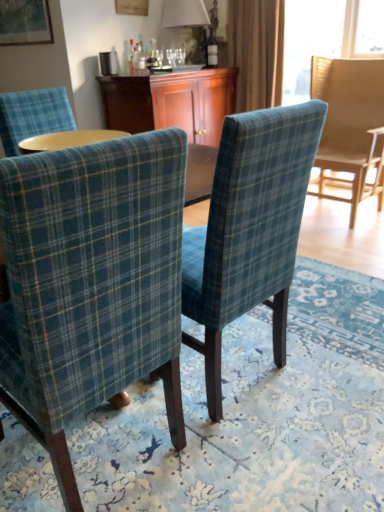
Find the location of a particular element. free area below teal plaid chair at right, the first chair when ordered from right to left (from a real-world perspective) is located at coordinates (330, 211).